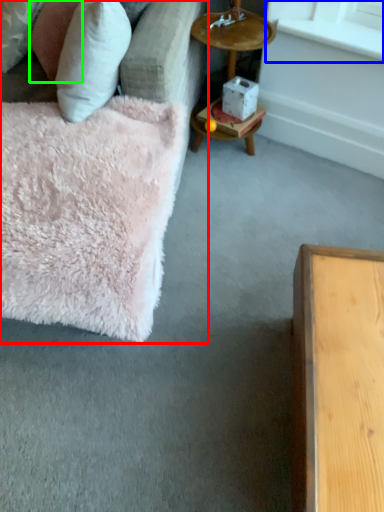
Question: Considering the real-world distances, which object is farthest from studio couch (highlighted by a red box)? window sill (highlighted by a blue box) or pillow (highlighted by a green box)?

Choices:
 (A) window sill
 (B) pillow

Answer: (A)